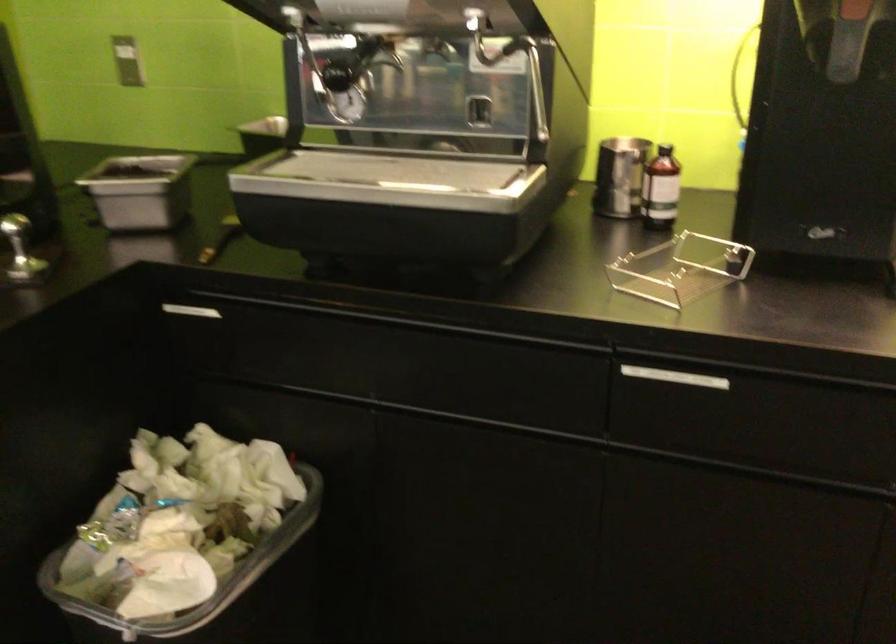
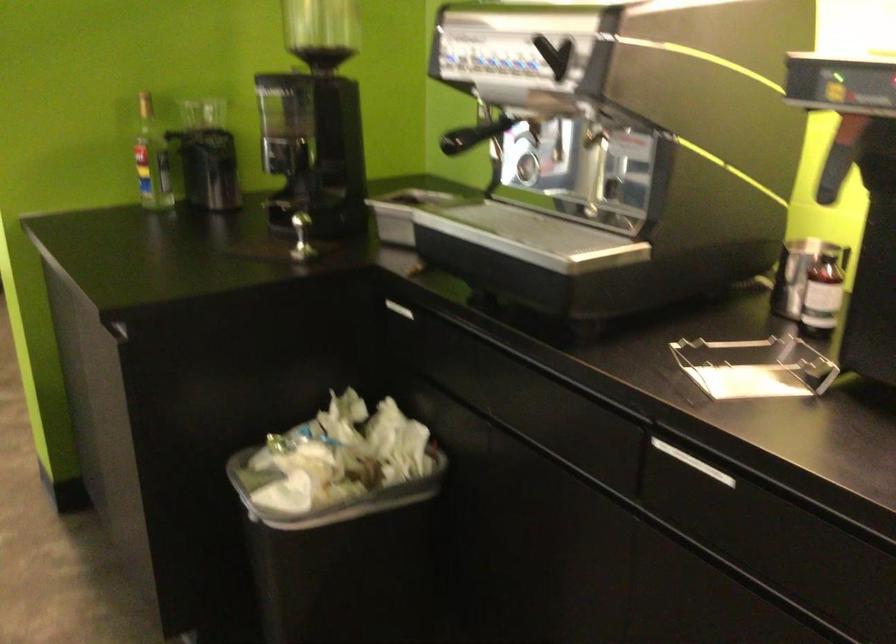
Find the pixel in the second image that matches point 185,310 in the first image.

(394, 308)